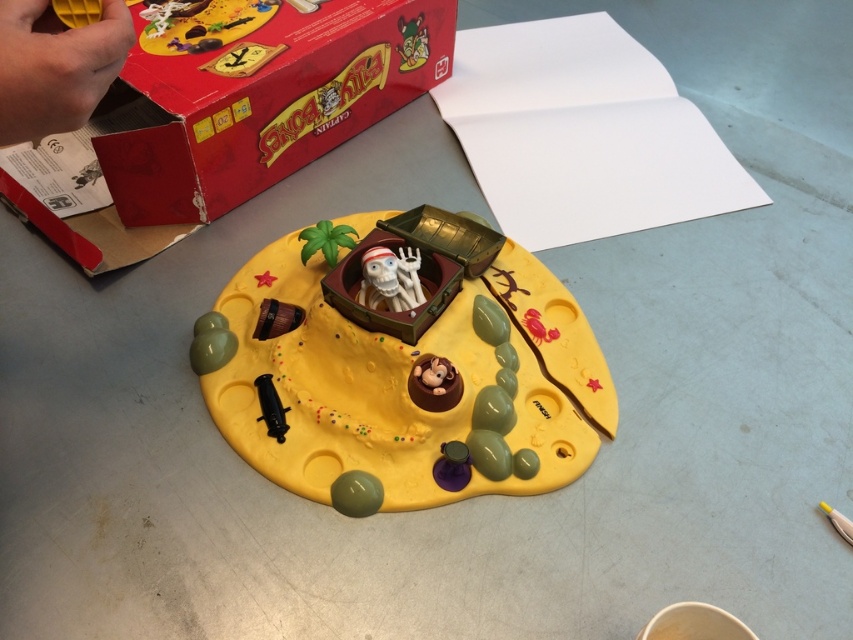
You are setting up the game and need to place the matte red box at upper left and the brown matte monkey at center on the table. Which object requires more horizontal space when placed side by side?

The matte red box at upper left might be wider than brown matte monkey at center, so it requires more horizontal space when placed side by side.

You are setting up the game and need to place the matte red box at upper left and the brown matte monkey at center on the table. If the table has limited space, which object should you prioritize keeping to ensure it fits?

The matte red box at upper left is larger than the brown matte monkey at center, so you should prioritize keeping the matte red box at upper left to ensure it fits on the table.